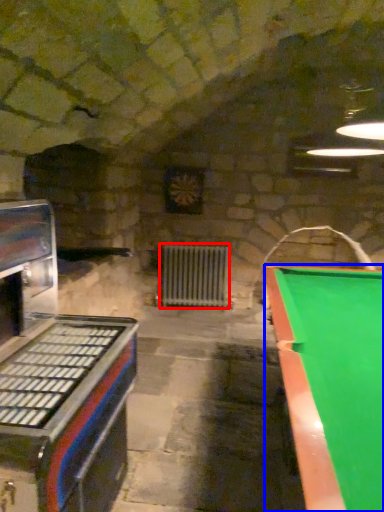
Question: Which object appears closest to the camera in this image, radiator (highlighted by a red box) or billiard table (highlighted by a blue box)?

Choices:
 (A) radiator
 (B) billiard table

Answer: (B)